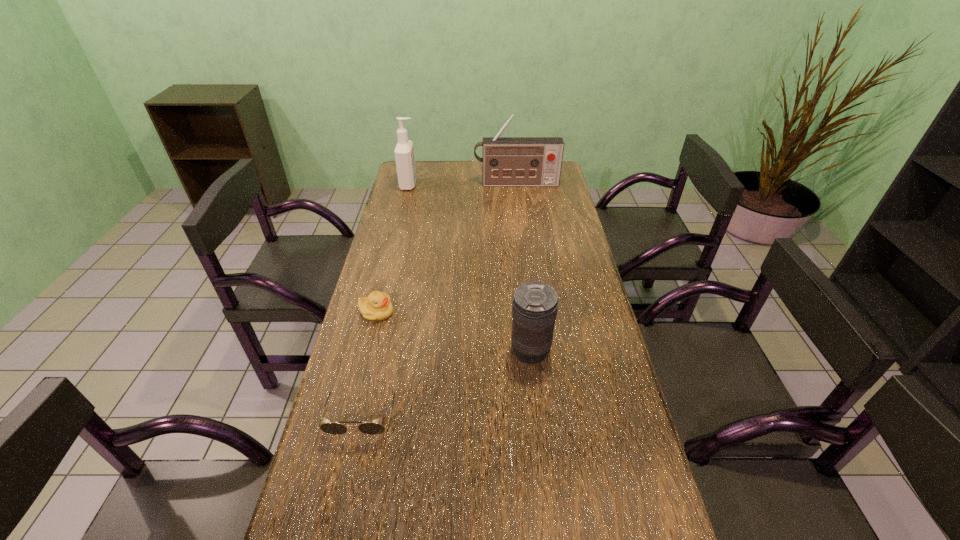
Locate an element on the screen. The image size is (960, 540). radio receiver is located at coordinates (507, 161).

Identify the location of cleansing agent. This screenshot has width=960, height=540. (404, 152).

Find the location of a particular element. The image size is (960, 540). the third tallest object is located at coordinates (534, 309).

At what (x,y) coordinates should I click in order to perform the action: click on telephoto lens. Please return your answer as a coordinate pair (x, y). This screenshot has width=960, height=540. Looking at the image, I should click on (534, 309).

I want to click on the third farthest object, so click(377, 306).

In order to click on sunglasses in this screenshot , I will do `click(332, 428)`.

The height and width of the screenshot is (540, 960). I want to click on blank space located on the front panel of the radio receiver, so click(522, 233).

Identify the location of vacant space located 0.080m on the front label of the cleansing agent. This screenshot has height=540, width=960. (436, 185).

At what (x,y) coordinates should I click in order to perform the action: click on free space located on the side of the third shortest object where the control switches are located. Please return your answer as a coordinate pair (x, y). This screenshot has height=540, width=960. Looking at the image, I should click on (430, 351).

You are a GUI agent. You are given a task and a screenshot of the screen. Output one action in this format:
    pyautogui.click(x=<x>, y=<y>)
    Task: Click on the free space located 0.090m on the side of the third shortest object where the control switches are located
    
    Given the screenshot: What is the action you would take?
    pyautogui.click(x=477, y=351)